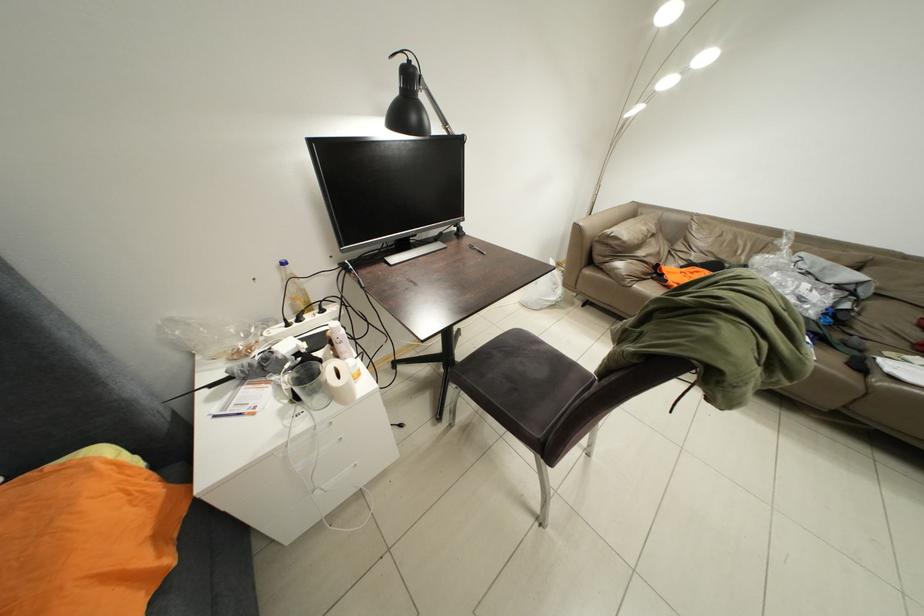
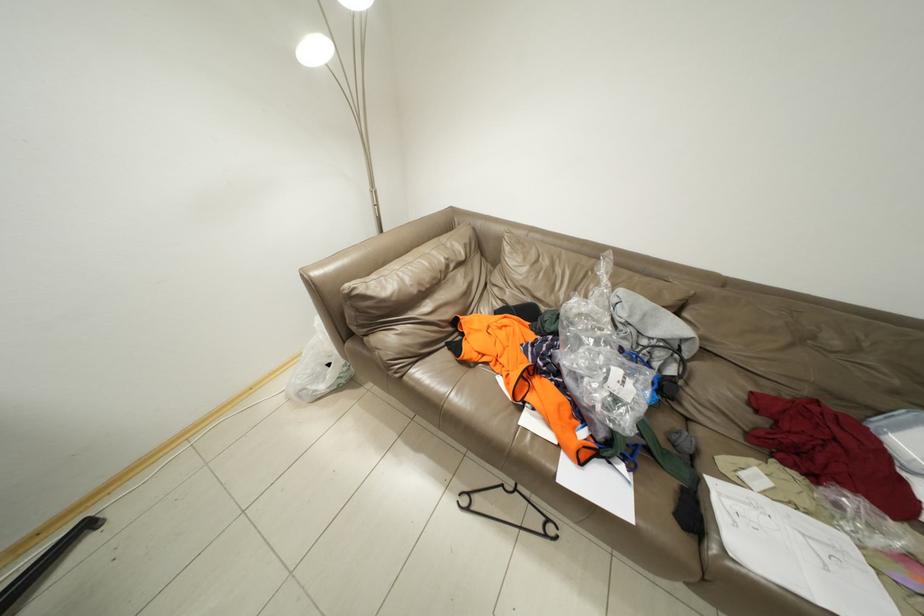
Which direction would the cameraman need to move to produce the second image?

The movement direction of the cameraman is right, forward.